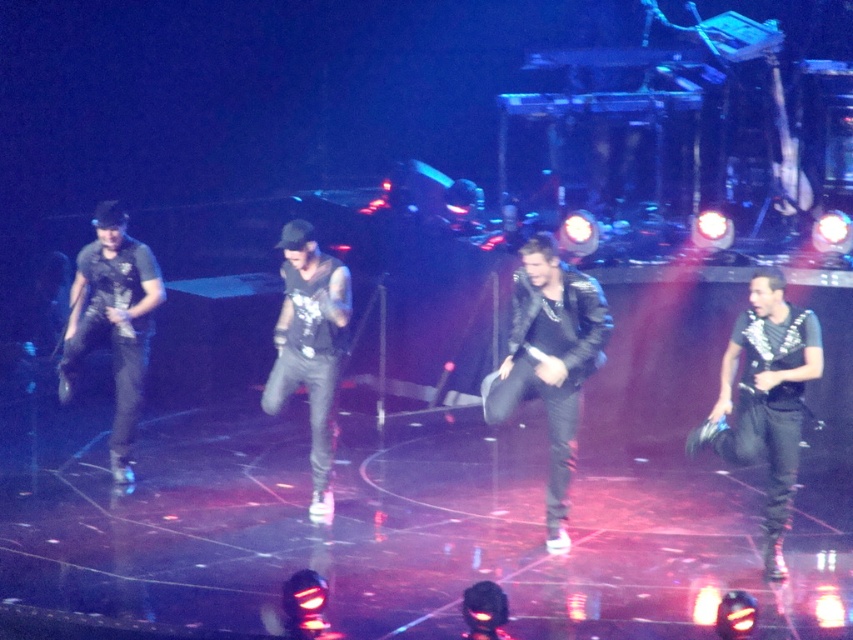
Question: Can you confirm if black leather jacket at right is thinner than matte black vest at left?

Choices:
 (A) yes
 (B) no

Answer: (A)

Question: Is leather jacket at center closer to camera compared to matte black vest at left?

Choices:
 (A) no
 (B) yes

Answer: (B)

Question: Is matte black vest at left thinner than black leather pants at center?

Choices:
 (A) no
 (B) yes

Answer: (A)

Question: Which point appears closest to the camera in this image?

Choices:
 (A) (117, 268)
 (B) (556, 536)
 (C) (821, 371)
 (D) (305, 371)

Answer: (C)

Question: Which object is farther from the camera taking this photo?

Choices:
 (A) leather jacket at center
 (B) black leather pants at center
 (C) matte black vest at left

Answer: (C)

Question: Which object is farther from the camera taking this photo?

Choices:
 (A) black leather jacket at right
 (B) black leather pants at center
 (C) matte black vest at left
 (D) leather jacket at center

Answer: (C)